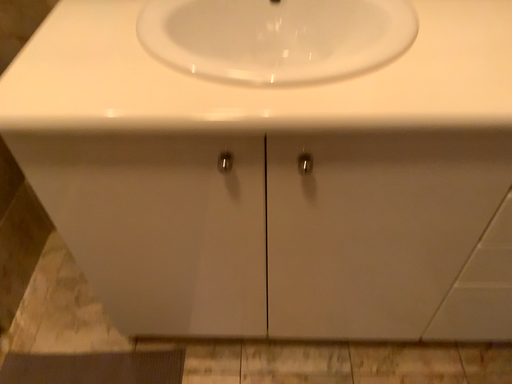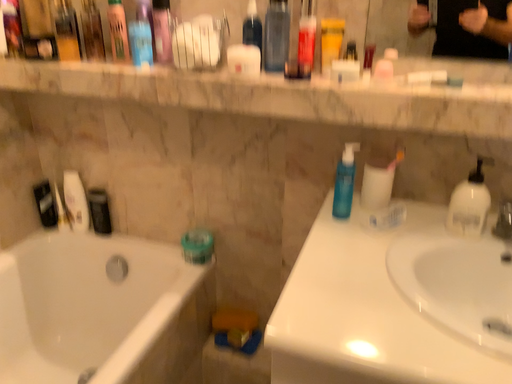
Question: Which way did the camera rotate in the video?

Choices:
 (A) rotated upward
 (B) rotated downward

Answer: (A)